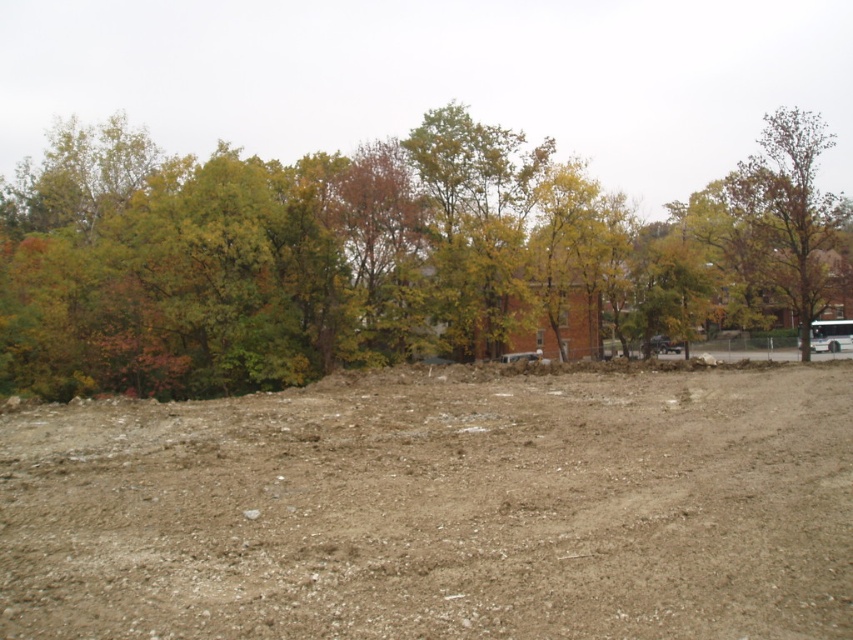
You are standing at the origin point of the image, which is the bottom left corner. You want to walk towards the green leafy tree at upper left. What direction should you head in?

Since the green leafy tree at upper left is located at coordinates point (x=386, y=257), you should head northeast from your current position at the origin point to reach it.